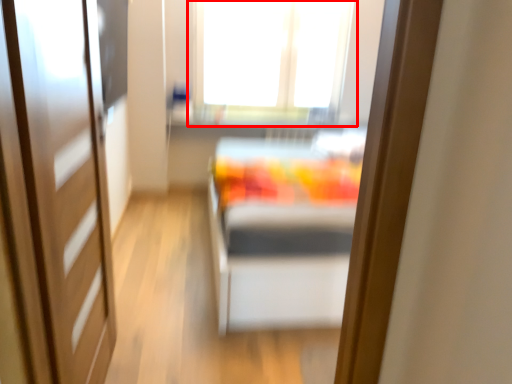
Question: From the image's perspective, where is window (annotated by the red box) located relative to door?

Choices:
 (A) below
 (B) above

Answer: (B)